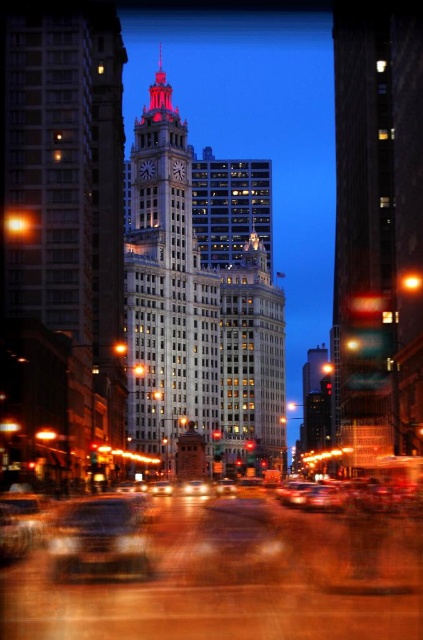
Can you confirm if white stone clock tower at center is bigger than shiny silver car at center?

Yes.

Is white stone clock tower at center positioned behind shiny silver car at center?

That is True.

Image resolution: width=423 pixels, height=640 pixels. I want to click on white stone clock tower at center, so click(200, 298).